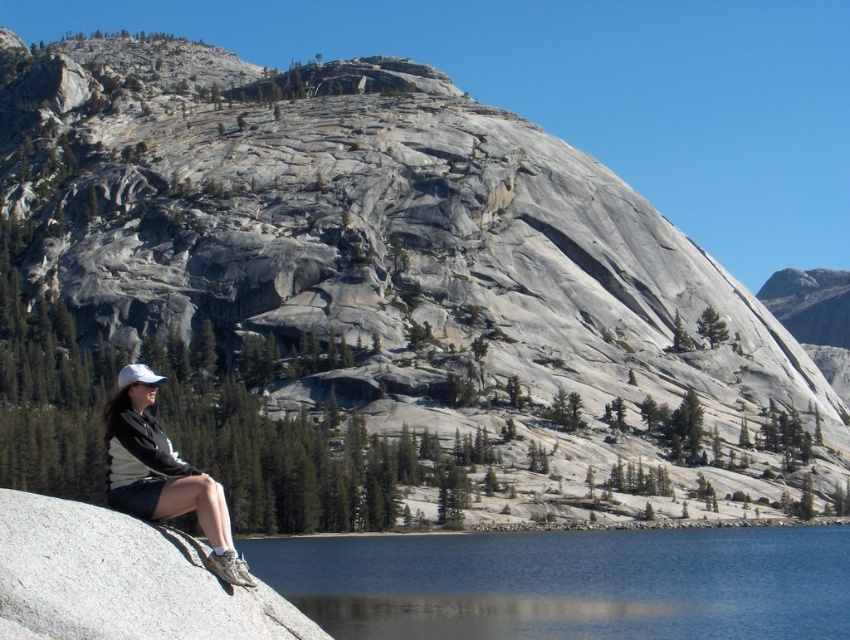
Question: Which of the following is the farthest from the observer?

Choices:
 (A) gray granite boulder at lower left
 (B) blue glassy water at lower center

Answer: (B)

Question: Is gray granite boulder at lower left closer to camera compared to white matte baseball cap at lower left?

Choices:
 (A) no
 (B) yes

Answer: (B)

Question: Does blue glassy water at lower center come in front of gray granite boulder at lower left?

Choices:
 (A) yes
 (B) no

Answer: (B)

Question: Which point appears closest to the camera in this image?

Choices:
 (A) (472, 592)
 (B) (212, 513)
 (C) (282, 600)

Answer: (B)

Question: Which object is farther from the camera taking this photo?

Choices:
 (A) gray granite boulder at lower left
 (B) white matte baseball cap at lower left

Answer: (B)

Question: Can you confirm if blue glassy water at lower center is positioned to the left of white matte baseball cap at lower left?

Choices:
 (A) yes
 (B) no

Answer: (B)